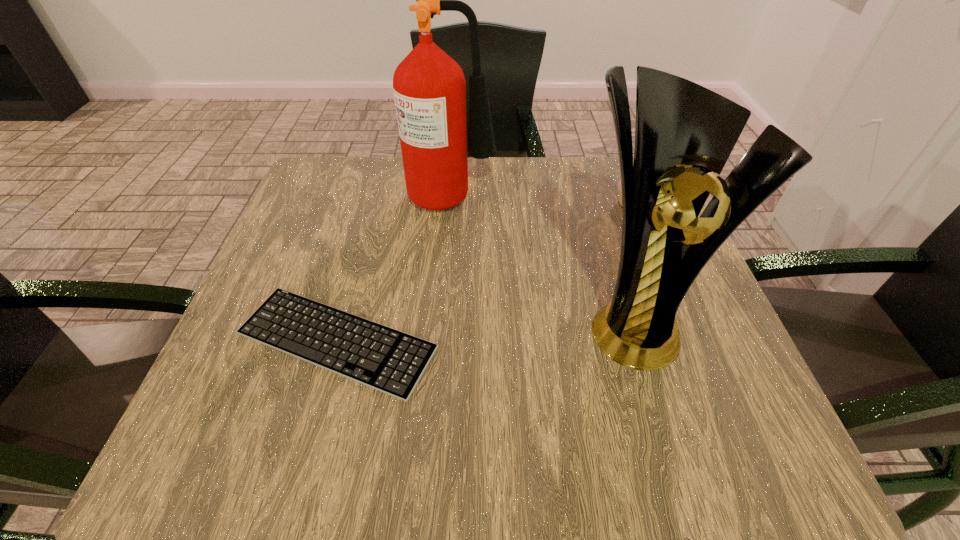
Locate an element on the screen. fire extinguisher is located at coordinates (429, 87).

The height and width of the screenshot is (540, 960). What are the coordinates of `award` in the screenshot? It's located at (684, 133).

Where is `the third tallest object`? Image resolution: width=960 pixels, height=540 pixels. the third tallest object is located at coordinates (619, 183).

Where is `computer keyboard`? The width and height of the screenshot is (960, 540). computer keyboard is located at coordinates (380, 357).

Locate an element on the screen. This screenshot has width=960, height=540. vacant region located 0.350m at the nozzle of the fire extinguisher is located at coordinates (645, 194).

The height and width of the screenshot is (540, 960). In order to click on vacant region located at the front of the award, where the globe is visible in this screenshot , I will do `click(675, 467)`.

Where is `free location located on the left of the third tallest object`? free location located on the left of the third tallest object is located at coordinates (468, 204).

This screenshot has height=540, width=960. I want to click on vacant region located on the back of the shortest object, so click(361, 251).

This screenshot has height=540, width=960. Find the location of `fire extinguisher at the far edge`. fire extinguisher at the far edge is located at coordinates (429, 87).

Where is `cupcake that is at the far edge`? cupcake that is at the far edge is located at coordinates (619, 183).